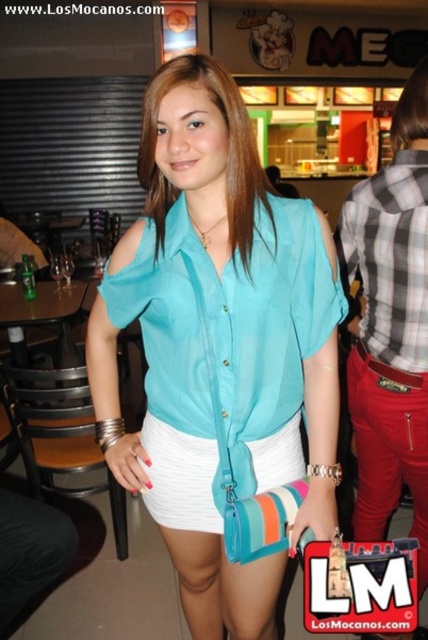
Question: Does matte blue blouse at center come behind plaid cotton shirt at right?

Choices:
 (A) no
 (B) yes

Answer: (A)

Question: Which object appears closest to the camera in this image?

Choices:
 (A) plaid fabric shirt at right
 (B) plaid cotton shirt at right
 (C) white fabric at center
 (D) matte blue blouse at center

Answer: (D)

Question: Which object is positioned closest to the plaid cotton shirt at right?

Choices:
 (A) matte blue blouse at center
 (B) plaid fabric shirt at right

Answer: (B)

Question: Which point appears closest to the camera in this image?

Choices:
 (A) (394, 164)
 (B) (246, 620)

Answer: (B)

Question: From the image, what is the correct spatial relationship of matte blue blouse at center in relation to plaid cotton shirt at right?

Choices:
 (A) below
 (B) above

Answer: (A)

Question: Does plaid fabric shirt at right come in front of white fabric at center?

Choices:
 (A) yes
 (B) no

Answer: (B)